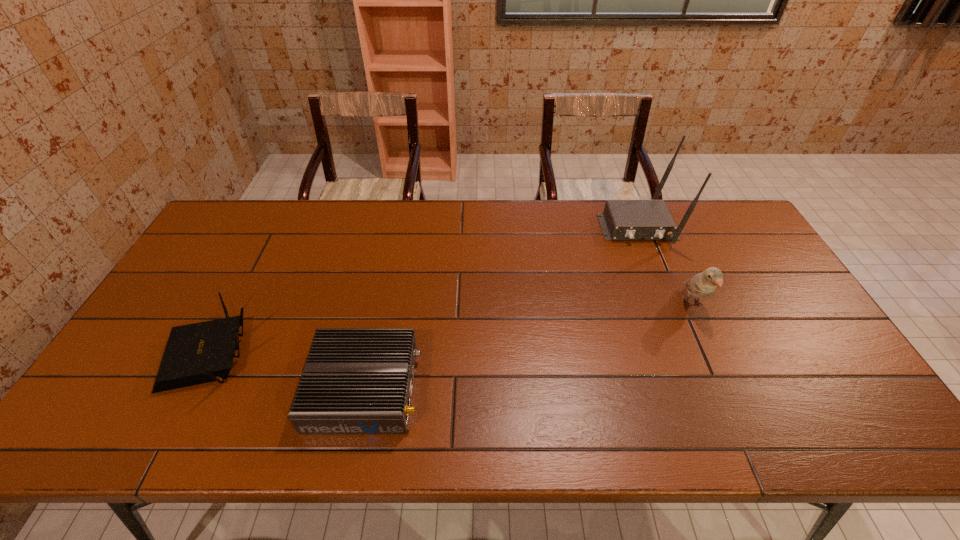
Find the location of a particular element. The width and height of the screenshot is (960, 540). the tallest router is located at coordinates (622, 219).

The width and height of the screenshot is (960, 540). Identify the location of the rightmost router. (622, 219).

In order to click on the second tallest object in this screenshot , I will do tap(703, 284).

The width and height of the screenshot is (960, 540). I want to click on the leftmost object, so click(x=198, y=353).

The height and width of the screenshot is (540, 960). In order to click on the second shortest router in this screenshot , I will do `click(198, 353)`.

Locate an element on the screen. This screenshot has height=540, width=960. the shortest object is located at coordinates (355, 380).

The image size is (960, 540). In order to click on the shortest router in this screenshot , I will do `click(355, 380)`.

Identify the location of vacant region located 0.150m on the back of the tallest object to connect cables. The image size is (960, 540). point(660,283).

The image size is (960, 540). In order to click on free space located 0.320m at the face of the third shortest object in this screenshot , I will do `click(752, 436)`.

Image resolution: width=960 pixels, height=540 pixels. I want to click on free space located 0.070m on the right of the leftmost router, so click(x=285, y=353).